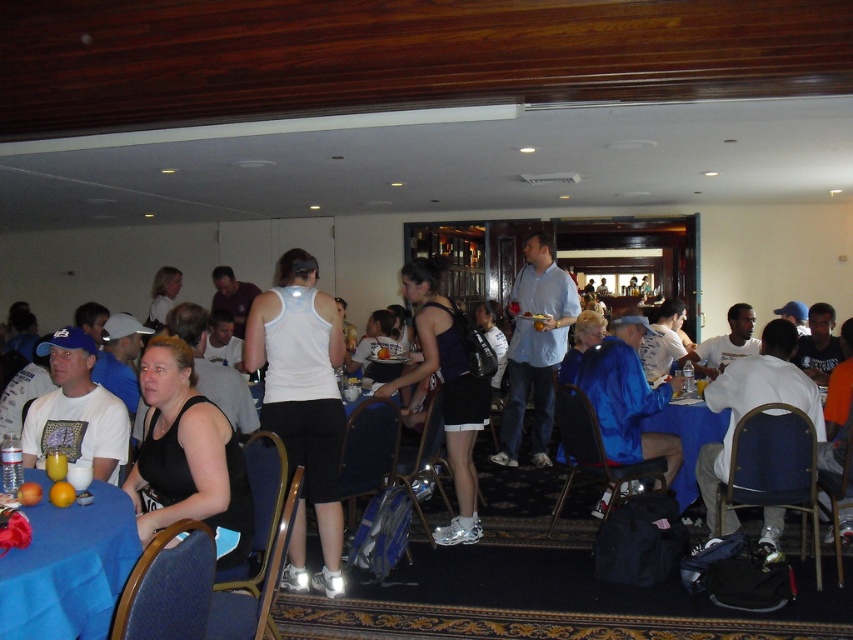
Consider the image. You are organizing a small event and need to decide if the white matte tank top at center can be placed on the blue fabric table at lower left without exceeding its surface area. Based on their sizes, can the tank top fit on the table?

The white matte tank top at center is narrower than the blue fabric table at lower left, so it should fit comfortably on the table without exceeding its surface area.

You are a photographer at the event and need to capture a photo that includes both the white matte tank top at center and the blue fabric table at lower left. Considering their heights, which object should be placed closer to the camera to ensure both are fully visible in the frame?

The white matte tank top at center is much taller than the blue fabric table at lower left, so placing the white matte tank top at center closer to the camera will ensure both are fully visible in the frame.

What is located at the point with coordinates (x=187, y=456)?

The black fabric tank top at center is located at point (x=187, y=456).